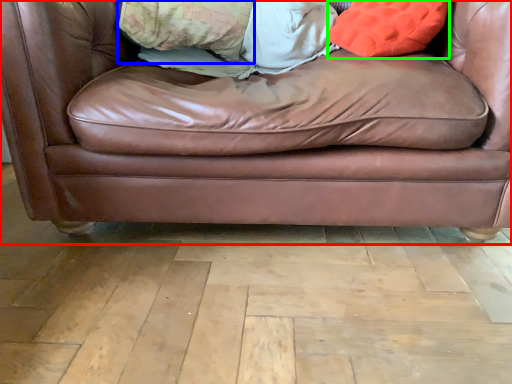
Question: Based on their relative distances, which object is nearer to studio couch (highlighted by a red box)? Choose from pillow (highlighted by a blue box) and throw pillow (highlighted by a green box).

Choices:
 (A) pillow
 (B) throw pillow

Answer: (B)